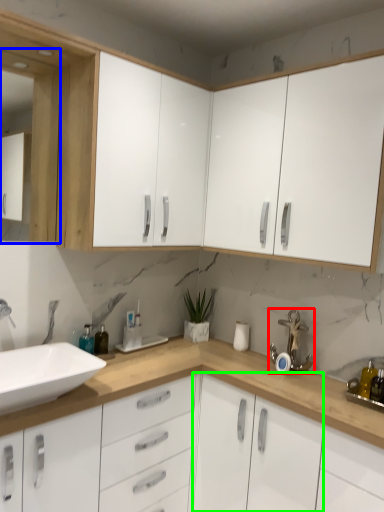
Question: Estimate the real-world distances between objects in this image. Which object is farther from faucet (highlighted by a red box), medicine cabinet (highlighted by a blue box) or cabinetry (highlighted by a green box)?

Choices:
 (A) medicine cabinet
 (B) cabinetry

Answer: (A)